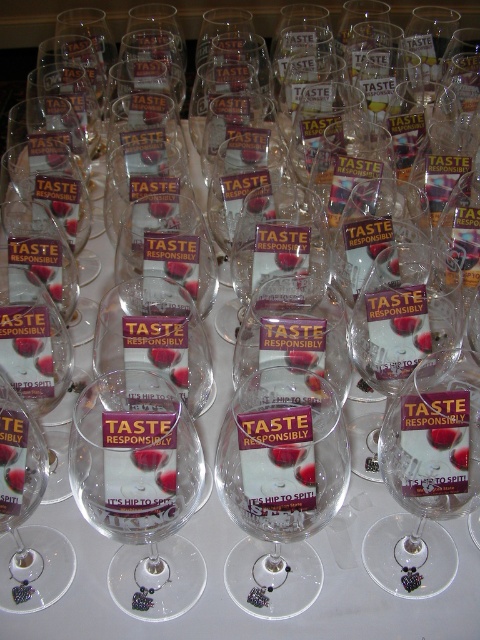
Question: Is the position of clear glass wine glass at center more distant than that of matte glass at center?

Choices:
 (A) yes
 (B) no

Answer: (B)

Question: Considering the real-world distances, which object is closest to the matte glass at center?

Choices:
 (A) clear glass wine at center
 (B) transparent glass at center
 (C) clear glass wine glass at center

Answer: (C)

Question: Does clear glass wine glass at center appear on the left side of clear glass wine at center?

Choices:
 (A) no
 (B) yes

Answer: (A)

Question: Which point is closer to the camera taking this photo?

Choices:
 (A) (156, 204)
 (B) (435, 444)
 (C) (96, 508)

Answer: (B)

Question: Can you confirm if matte glass at center is thinner than clear glass wine at center?

Choices:
 (A) no
 (B) yes

Answer: (B)

Question: Which object is positioned closest to the clear glass wine at center?

Choices:
 (A) matte glass at center
 (B) clear glass wine glass at center
 (C) transparent glass at center

Answer: (B)